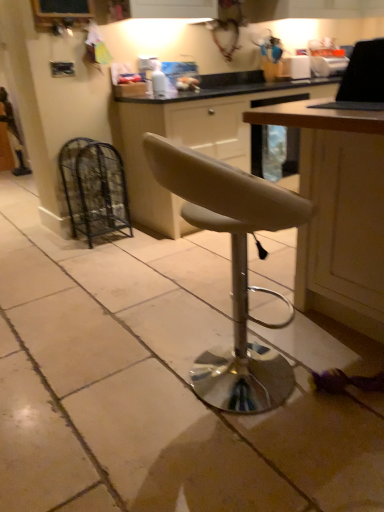
You are a GUI agent. You are given a task and a screenshot of the screen. Output one action in this format:
    pyautogui.click(x=<x>, y=<y>)
    Task: Click on the free region under black wire mesh cage at left (from a real-world perspective)
    The height and width of the screenshot is (512, 384).
    Given the screenshot: What is the action you would take?
    (x=100, y=237)